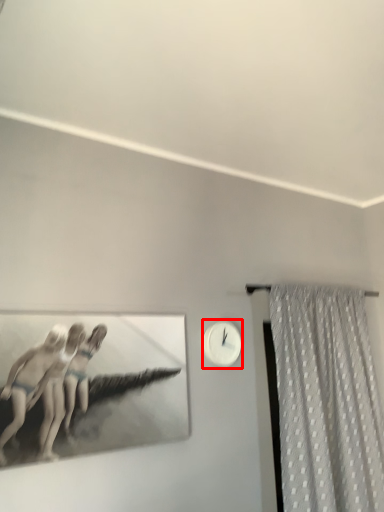
Question: In this image, where is clock (annotated by the red box) located relative to curtain?

Choices:
 (A) right
 (B) left

Answer: (B)